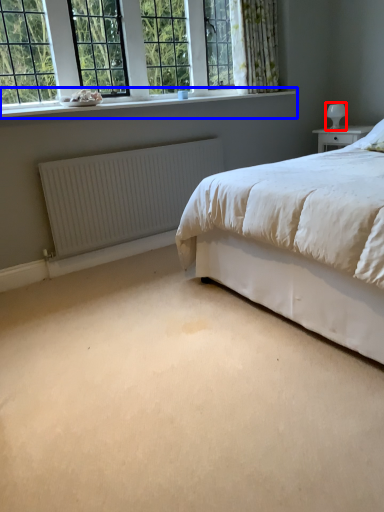
Question: Which object is closer to the camera taking this photo, table lamp (highlighted by a red box) or window sill (highlighted by a blue box)?

Choices:
 (A) table lamp
 (B) window sill

Answer: (B)